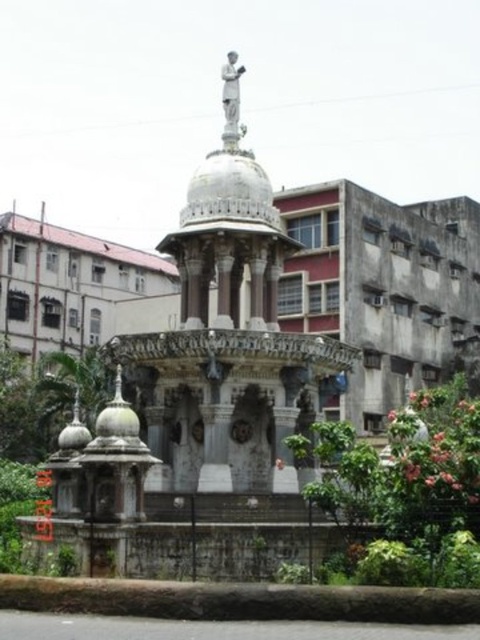
The width and height of the screenshot is (480, 640). Describe the element at coordinates (200, 413) in the screenshot. I see `white marble fountain at center` at that location.

Who is more distant from viewer, (x=177, y=344) or (x=242, y=132)?

The point (x=242, y=132) is more distant.

Where is `white marble fountain at center`? The width and height of the screenshot is (480, 640). white marble fountain at center is located at coordinates coord(200,413).